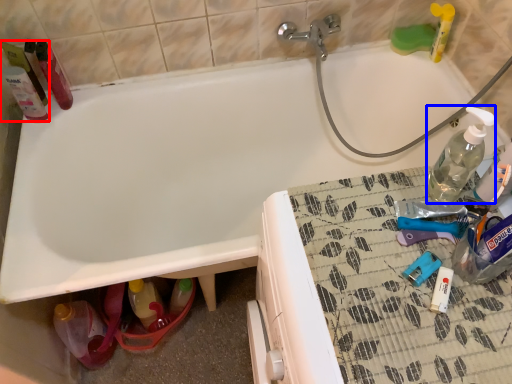
Question: Which object appears farthest to the camera in this image, cleaning product (highlighted by a red box) or bottle (highlighted by a blue box)?

Choices:
 (A) cleaning product
 (B) bottle

Answer: (A)